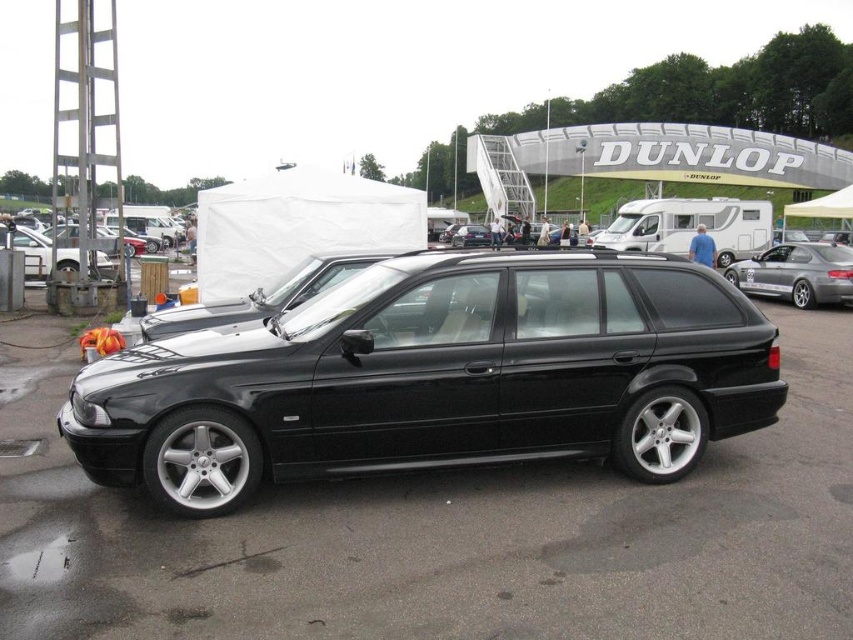
Is matte black wagon at left to the right of matte black car at left from the viewer's perspective?

Indeed, matte black wagon at left is positioned on the right side of matte black car at left.

Which is more to the left, matte black wagon at left or matte black car at left?

matte black car at left

The image size is (853, 640). Describe the element at coordinates (33, 252) in the screenshot. I see `matte black wagon at left` at that location.

At what (x,y) coordinates should I click in order to perform the action: click on matte black wagon at left. Please return your answer as a coordinate pair (x, y). Looking at the image, I should click on (33, 252).

Is the position of black metallic car at center more distant than that of satin silver metallic sedan at right?

No, black metallic car at center is closer to the viewer.

Does point (450, 449) come behind point (758, 278)?

No.

Does point (287, 372) come behind point (756, 285)?

No, (287, 372) is in front of (756, 285).

At what (x,y) coordinates should I click in order to perform the action: click on black metallic car at center. Please return your answer as a coordinate pair (x, y). The height and width of the screenshot is (640, 853). Looking at the image, I should click on (437, 378).

Which of these two, black metallic car at center or matte black car at left, stands shorter?

Standing shorter between the two is black metallic car at center.

This screenshot has height=640, width=853. Find the location of `black metallic car at center`. black metallic car at center is located at coordinates (437, 378).